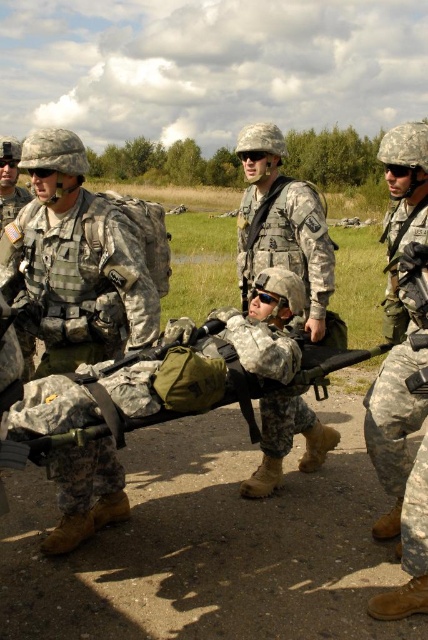
Does camouflage uniform at right appear on the right side of camouflage fabric stretcher at center?

Yes, camouflage uniform at right is to the right of camouflage fabric stretcher at center.

Describe the element at coordinates (403, 371) in the screenshot. I see `camouflage uniform at right` at that location.

Is point (422, 541) positioned after point (118, 413)?

Yes, it is behind point (118, 413).

Identify the location of camouflage uniform at right. [403, 371].

Can you confirm if camouflage fabric uniform at center is thinner than camouflage uniform at center?

No, camouflage fabric uniform at center is not thinner than camouflage uniform at center.

Is camouflage fabric uniform at center in front of camouflage uniform at center?

Yes, it is in front of camouflage uniform at center.

Is point (56, 317) closer to viewer compared to point (256, 490)?

Yes, point (56, 317) is closer to viewer.

Where is `camouflage fabric uniform at center`? The width and height of the screenshot is (428, 640). camouflage fabric uniform at center is located at coordinates (79, 260).

Is point (32, 164) farther from camera compared to point (406, 172)?

No.

Between camouflage fabric uniform at center and camouflage uniform at right, which one has more height?

Standing taller between the two is camouflage uniform at right.

This screenshot has height=640, width=428. In order to click on camouflage fabric uniform at center in this screenshot , I will do `click(79, 260)`.